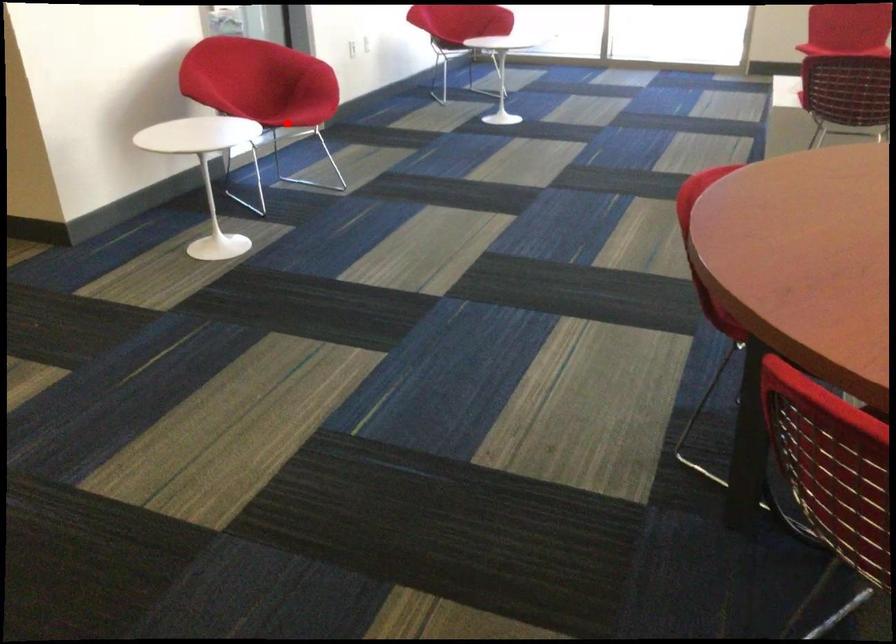
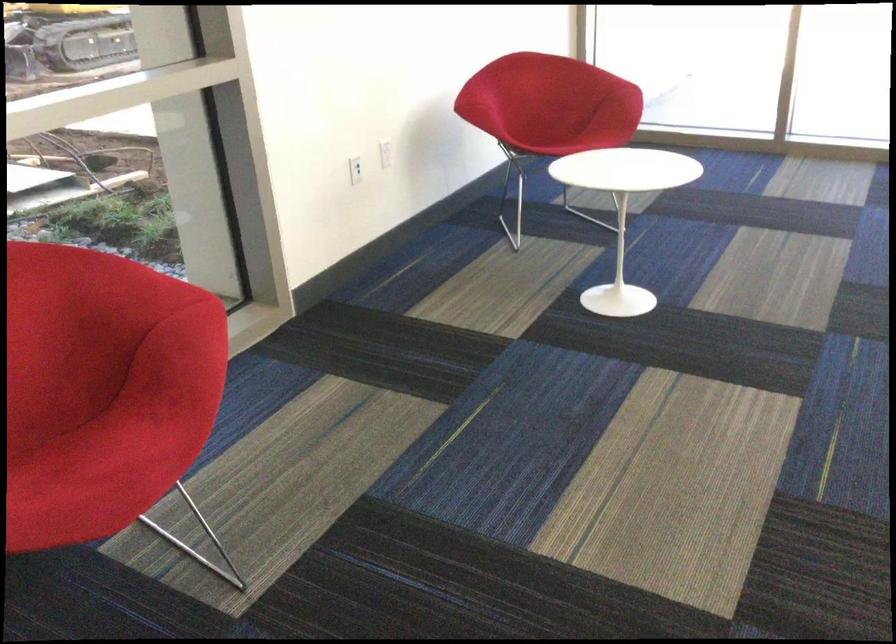
Locate, in the second image, the point that corresponds to the highlighted location in the first image.

(115, 450)